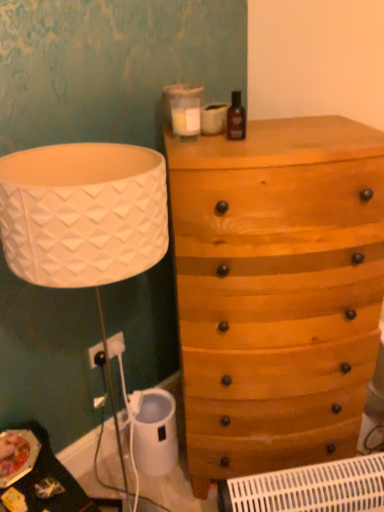
Question: Considering the relative sizes of wooden chest of drawers at upper right and white plastic radiator at lower center in the image provided, is wooden chest of drawers at upper right taller than white plastic radiator at lower center?

Choices:
 (A) yes
 (B) no

Answer: (A)

Question: Does wooden chest of drawers at upper right appear on the right side of white plastic radiator at lower center?

Choices:
 (A) yes
 (B) no

Answer: (B)

Question: Is wooden chest of drawers at upper right positioned with its back to white plastic radiator at lower center?

Choices:
 (A) no
 (B) yes

Answer: (A)

Question: Considering the relative sizes of wooden chest of drawers at upper right and white plastic radiator at lower center in the image provided, is wooden chest of drawers at upper right thinner than white plastic radiator at lower center?

Choices:
 (A) yes
 (B) no

Answer: (B)

Question: Is wooden chest of drawers at upper right placed right next to white plastic radiator at lower center?

Choices:
 (A) no
 (B) yes

Answer: (A)

Question: From the image's perspective, is wooden chest of drawers at upper right on white plastic radiator at lower center?

Choices:
 (A) no
 (B) yes

Answer: (B)

Question: Is white plastic radiator at lower center positioned behind white plastic electric outlet at lower left?

Choices:
 (A) yes
 (B) no

Answer: (B)

Question: Is white plastic radiator at lower center in contact with white plastic electric outlet at lower left?

Choices:
 (A) yes
 (B) no

Answer: (B)

Question: Does white plastic radiator at lower center have a lesser height compared to white plastic electric outlet at lower left?

Choices:
 (A) yes
 (B) no

Answer: (B)

Question: Is white plastic radiator at lower center not inside white plastic electric outlet at lower left?

Choices:
 (A) yes
 (B) no

Answer: (A)

Question: Would you say white plastic radiator at lower center is a long distance from white plastic electric outlet at lower left?

Choices:
 (A) no
 (B) yes

Answer: (A)

Question: Does white plastic radiator at lower center have a lesser width compared to white plastic electric outlet at lower left?

Choices:
 (A) no
 (B) yes

Answer: (A)

Question: Is white plastic radiator at lower center thinner than wooden chest of drawers at upper right?

Choices:
 (A) no
 (B) yes

Answer: (B)